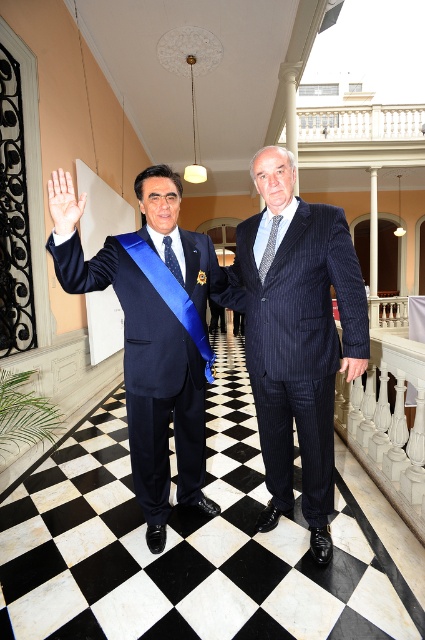
Question: Which object is positioned closest to the dark blue pinstripe suit at center?

Choices:
 (A) patterned silk tie at center
 (B) black leather hand at right
 (C) smooth skin palm at center
 (D) blue silk tie at center

Answer: (A)

Question: Is smooth skin palm at center thinner than black leather hand at right?

Choices:
 (A) no
 (B) yes

Answer: (A)

Question: Does dark blue pinstripe suit at center have a lesser width compared to smooth skin palm at center?

Choices:
 (A) no
 (B) yes

Answer: (A)

Question: Among these points, which one is farthest from the camera?

Choices:
 (A) (51, 179)
 (B) (187, 253)
 (C) (354, 376)

Answer: (B)

Question: Can you confirm if matte blue suit at center is thinner than blue silk tie at center?

Choices:
 (A) yes
 (B) no

Answer: (B)

Question: Which object appears farthest from the camera in this image?

Choices:
 (A) dark blue pinstripe suit at center
 (B) patterned silk tie at center
 (C) blue silk tie at center
 (D) matte blue suit at center

Answer: (C)